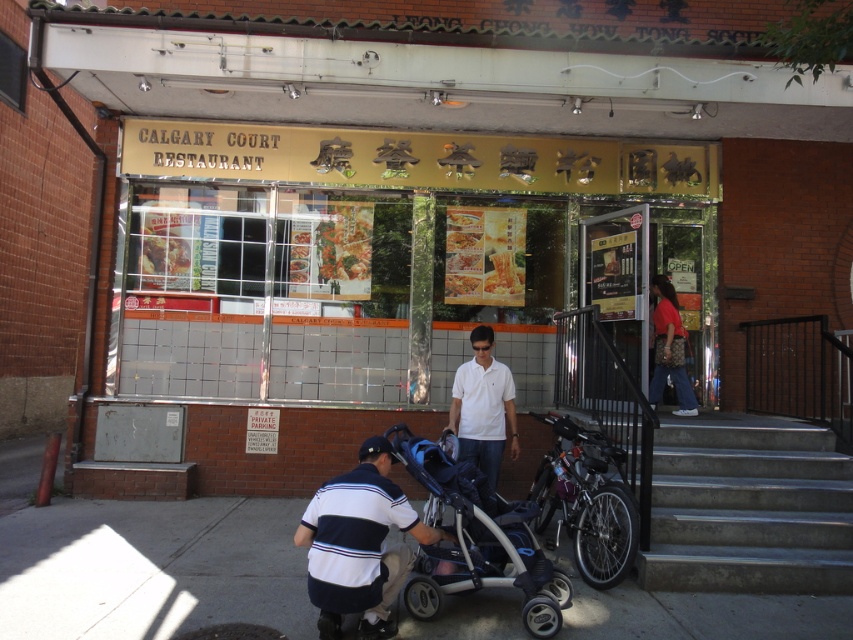
Question: Does white striped shirt at lower center appear under matte red shirt at entrance?

Choices:
 (A) yes
 (B) no

Answer: (A)

Question: Does gray concrete pavement at lower left lie behind white matte shirt at center?

Choices:
 (A) no
 (B) yes

Answer: (A)

Question: Which object is farther from the camera taking this photo?

Choices:
 (A) matte red shirt at entrance
 (B) black textured stroller at center

Answer: (A)

Question: Which object appears closest to the camera in this image?

Choices:
 (A) white striped shirt at lower center
 (B) matte red shirt at entrance

Answer: (A)

Question: Among these points, which one is nearest to the camera?

Choices:
 (A) (189, 275)
 (B) (654, 397)
 (C) (508, 512)
 (D) (334, 518)

Answer: (D)

Question: From the image, what is the correct spatial relationship of gray concrete pavement at lower left in relation to white matte shirt at center?

Choices:
 (A) below
 (B) above

Answer: (A)